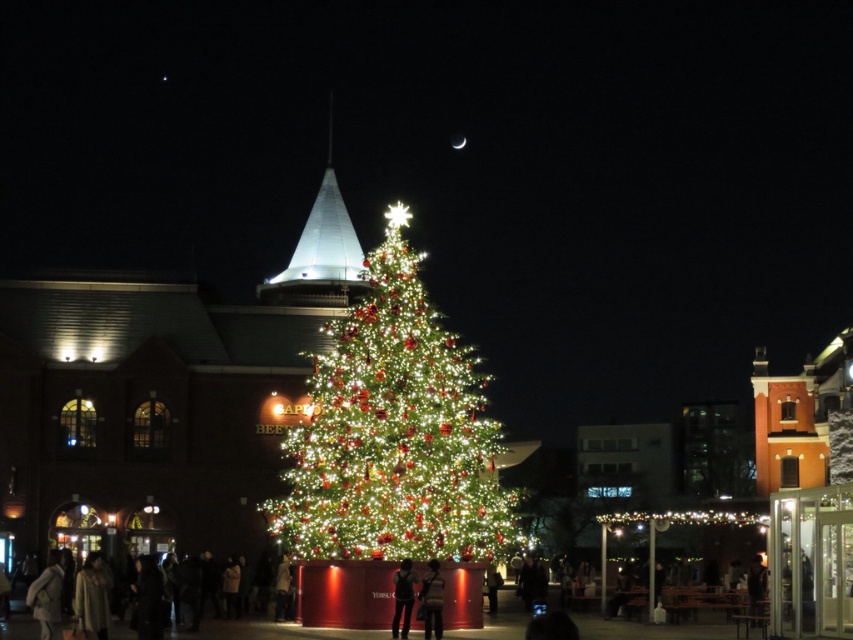
Question: Can you confirm if white glossy spire at center is positioned to the left of dark gray fabric jacket at center?

Choices:
 (A) yes
 (B) no

Answer: (A)

Question: Which of these objects is positioned closest to the white glossy spire at center?

Choices:
 (A) dark gray fabric jacket at center
 (B) illuminated green christmas tree at center
 (C) dark clothing at center

Answer: (B)

Question: Which point is farther to the camera?

Choices:
 (A) illuminated green christmas tree at center
 (B) dark gray fabric jacket at center
 (C) dark clothing at center

Answer: (A)

Question: Based on their relative distances, which object is nearer to the white glossy spire at center?

Choices:
 (A) dark gray fabric jacket at center
 (B) illuminated green christmas tree at center
 (C) dark clothing at center

Answer: (B)

Question: Is dark gray fabric jacket at center wider than dark clothing at center?

Choices:
 (A) yes
 (B) no

Answer: (B)

Question: From the image, what is the correct spatial relationship of illuminated green christmas tree at center in relation to white glossy spire at center?

Choices:
 (A) right
 (B) left

Answer: (A)